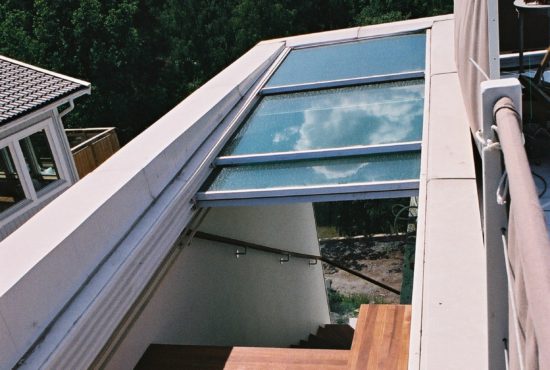
The image size is (550, 370). In order to click on window in this screenshot , I will do `click(5, 216)`.